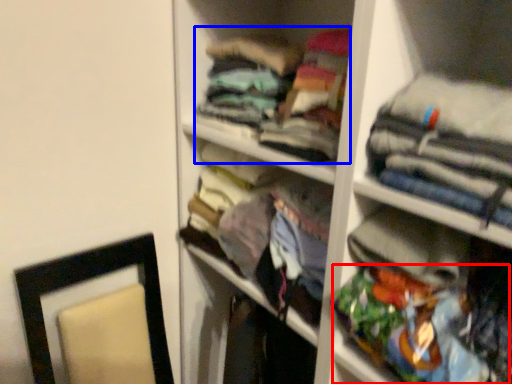
Question: Which object is closer to the camera taking this photo, clothing (highlighted by a red box) or clothing (highlighted by a blue box)?

Choices:
 (A) clothing
 (B) clothing

Answer: (A)